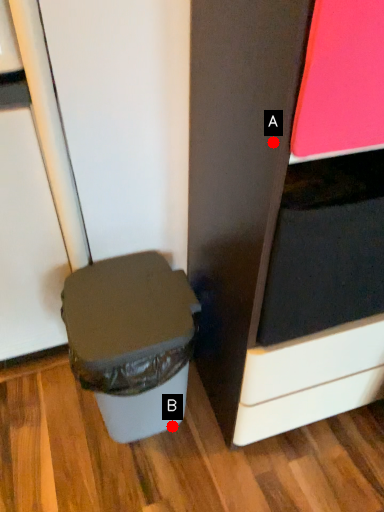
Question: Two points are circled on the image, labeled by A and B beside each circle. Which point is closer to the camera?

Choices:
 (A) A is closer
 (B) B is closer

Answer: (A)